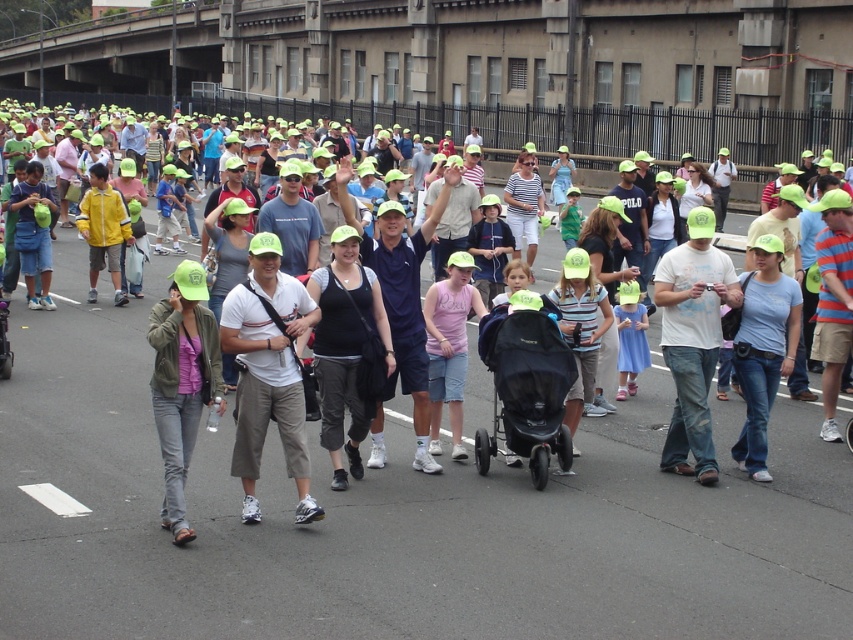
Question: Can you confirm if black matte stroller at center is positioned above striped cotton shirt at center?

Choices:
 (A) no
 (B) yes

Answer: (A)

Question: Which point is closer to the camera taking this photo?

Choices:
 (A) (415, 490)
 (B) (180, 525)
 (C) (244, 292)
 (D) (730, 294)

Answer: (B)

Question: Which point is farther from the camera taking this photo?

Choices:
 (A) (x=283, y=420)
 (B) (x=119, y=216)
 (C) (x=753, y=317)

Answer: (B)

Question: Which point is closer to the camera?

Choices:
 (A) (550, 280)
 (B) (782, 307)
 (C) (538, 360)

Answer: (C)

Question: Is matte black stroller at center to the left of green matte cap at center from the viewer's perspective?

Choices:
 (A) no
 (B) yes

Answer: (A)

Question: Is matte black stroller at center to the left of green matte cap at center from the viewer's perspective?

Choices:
 (A) no
 (B) yes

Answer: (A)